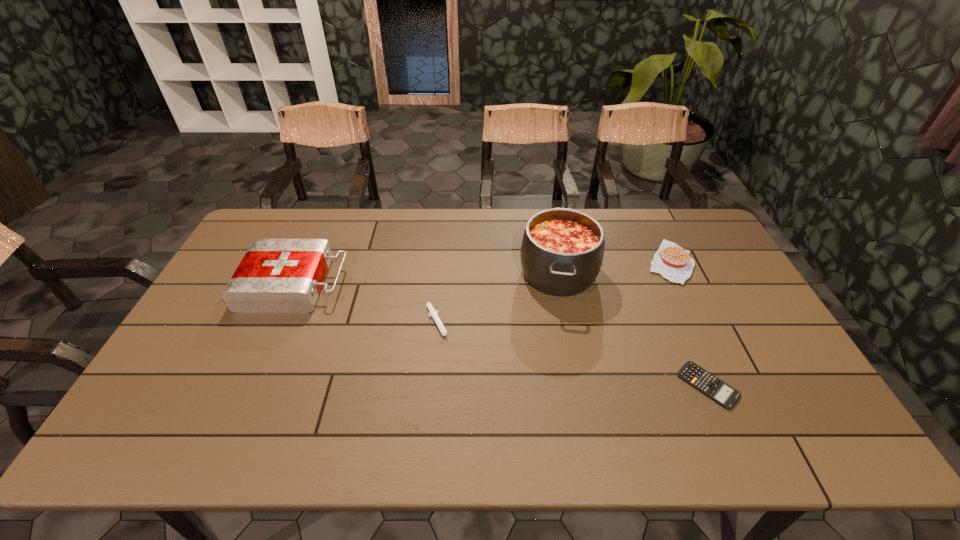
Identify the location of vacant region between the pie and the third object from right to left. (614, 267).

Locate an element on the screen. The image size is (960, 540). free space that is in between the pie and the first-aid kit is located at coordinates (482, 273).

In order to click on free spot between the pie and the fourth shortest object in this screenshot , I will do `click(482, 273)`.

Select which object appears as the closest to the nearest object. Please provide its 2D coordinates. Your answer should be formatted as a tuple, i.e. [(x, y)], where the tuple contains the x and y coordinates of a point satisfying the conditions above.

[(562, 249)]

Find the location of `object identified as the third closest to the second tallest object`. object identified as the third closest to the second tallest object is located at coordinates (722, 393).

Where is `vacant position in the image that satisfies the following two spatial constraints: 1. on the front side of the second shortest object; 2. on the left side of the second tallest object`? This screenshot has width=960, height=540. vacant position in the image that satisfies the following two spatial constraints: 1. on the front side of the second shortest object; 2. on the left side of the second tallest object is located at coordinates (276, 326).

Where is `vacant position in the image that satisfies the following two spatial constraints: 1. on the back side of the second shortest object; 2. on the right side of the pie`? The width and height of the screenshot is (960, 540). vacant position in the image that satisfies the following two spatial constraints: 1. on the back side of the second shortest object; 2. on the right side of the pie is located at coordinates (444, 262).

At what (x,y) coordinates should I click in order to perform the action: click on free space that satisfies the following two spatial constraints: 1. on the back side of the second shortest object; 2. on the right side of the pie. Please return your answer as a coordinate pair (x, y). Looking at the image, I should click on (444, 262).

Locate an element on the screen. Image resolution: width=960 pixels, height=540 pixels. vacant space that satisfies the following two spatial constraints: 1. on the back side of the second shortest object; 2. on the left side of the third shortest object is located at coordinates (444, 262).

Find the location of a particular element. blank area in the image that satisfies the following two spatial constraints: 1. on the back side of the third object from right to left; 2. on the right side of the fourth object from right to left is located at coordinates (444, 273).